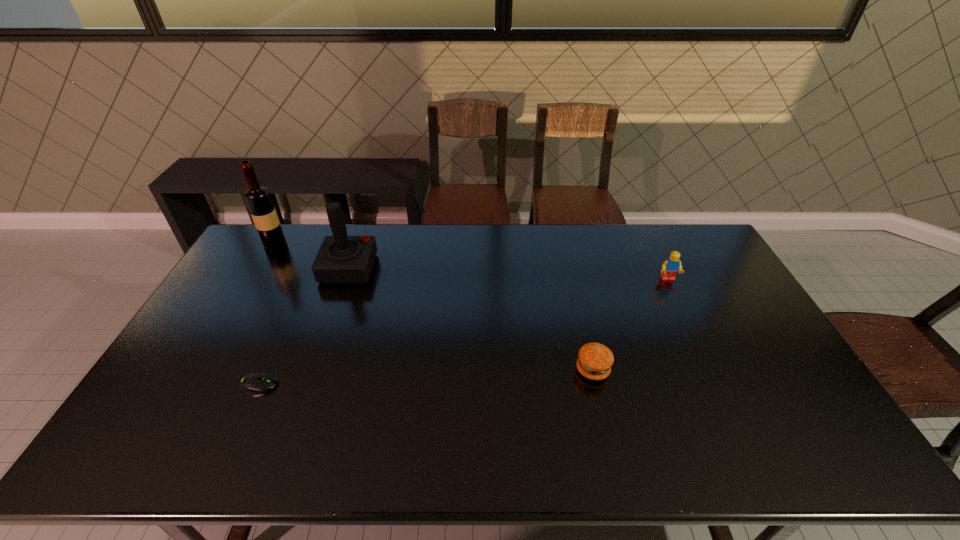
This screenshot has height=540, width=960. Identify the location of blank region between the fourth tallest object and the shortest object. (425, 377).

Where is `free space between the wine bottle and the computer mouse`? The image size is (960, 540). free space between the wine bottle and the computer mouse is located at coordinates (267, 314).

This screenshot has width=960, height=540. Identify the location of object that is the fourth closest to the leftmost object. (672, 265).

In order to click on object identified as the third closest to the Lego in this screenshot , I will do tap(254, 382).

Image resolution: width=960 pixels, height=540 pixels. Identify the location of free point that satisfies the following two spatial constraints: 1. on the base of the fourth tallest object; 2. on the left side of the second tallest object. (313, 370).

This screenshot has width=960, height=540. I want to click on vacant area in the image that satisfies the following two spatial constraints: 1. on the base of the second tallest object; 2. on the left side of the fourth object from left to right, so click(313, 370).

Locate an element on the screen. vacant area that satisfies the following two spatial constraints: 1. on the front-facing side of the third tallest object; 2. on the wheel side of the computer mouse is located at coordinates (719, 384).